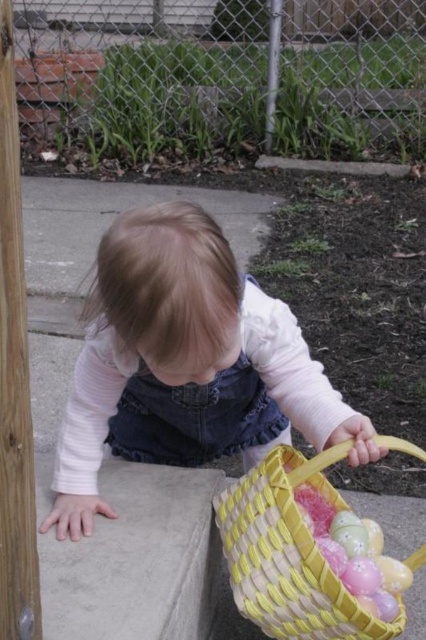
Between yellow woven basket at lower right and pastel plastic eggs at lower center, which one appears on the left side from the viewer's perspective?

yellow woven basket at lower right

Is point (333, 602) in front of point (316, 541)?

Yes.

Which is in front, point (261, 566) or point (354, 548)?

Point (261, 566) is more forward.

Image resolution: width=426 pixels, height=640 pixels. I want to click on yellow woven basket at lower right, so click(288, 554).

Who is positioned more to the left, pink denim overalls at center or yellow woven basket at lower right?

pink denim overalls at center is more to the left.

Between point (178, 232) and point (347, 636), which one is positioned in front?

Point (178, 232) is more forward.

At what (x,y) coordinates should I click in order to perform the action: click on pink denim overalls at center. Please return your answer as a coordinate pair (x, y). Looking at the image, I should click on (181, 353).

Can you confirm if pink denim overalls at center is positioned to the left of pastel plastic eggs at lower center?

Indeed, pink denim overalls at center is positioned on the left side of pastel plastic eggs at lower center.

In the scene shown: Who is positioned more to the right, pink denim overalls at center or pastel plastic eggs at lower center?

From the viewer's perspective, pastel plastic eggs at lower center appears more on the right side.

Between point (129, 257) and point (393, 595), which one is positioned behind?

The point (393, 595) is more distant.

Where is `pink denim overalls at center`? pink denim overalls at center is located at coordinates (181, 353).